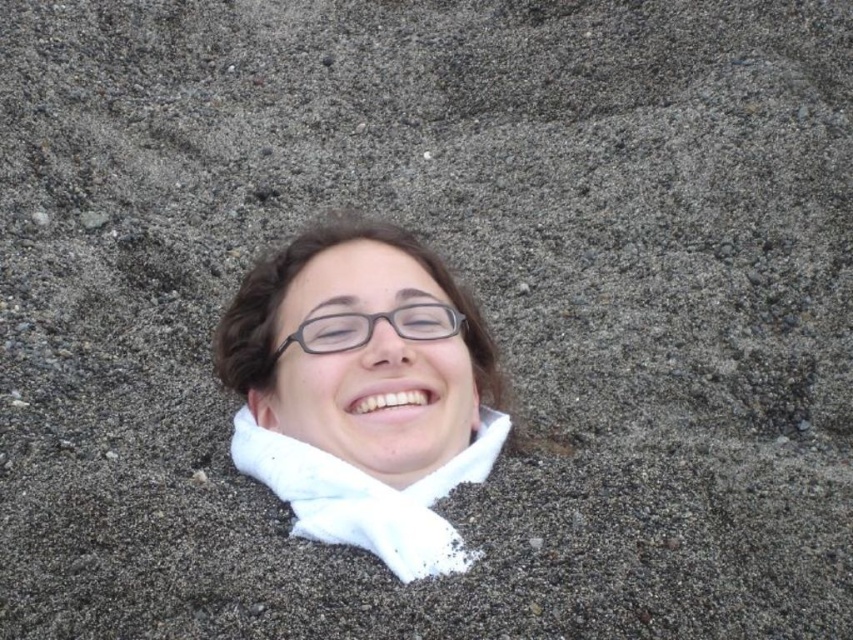
Does point (331, 541) come in front of point (405, 308)?

Yes, point (331, 541) is in front of point (405, 308).

Which is more to the right, white matte scarf at center or matte black glasses at center?

Positioned to the right is white matte scarf at center.

Is point (426, 528) in front of point (454, 316)?

Yes, point (426, 528) is in front of point (454, 316).

Locate an element on the screen. Image resolution: width=853 pixels, height=640 pixels. white matte scarf at center is located at coordinates (363, 390).